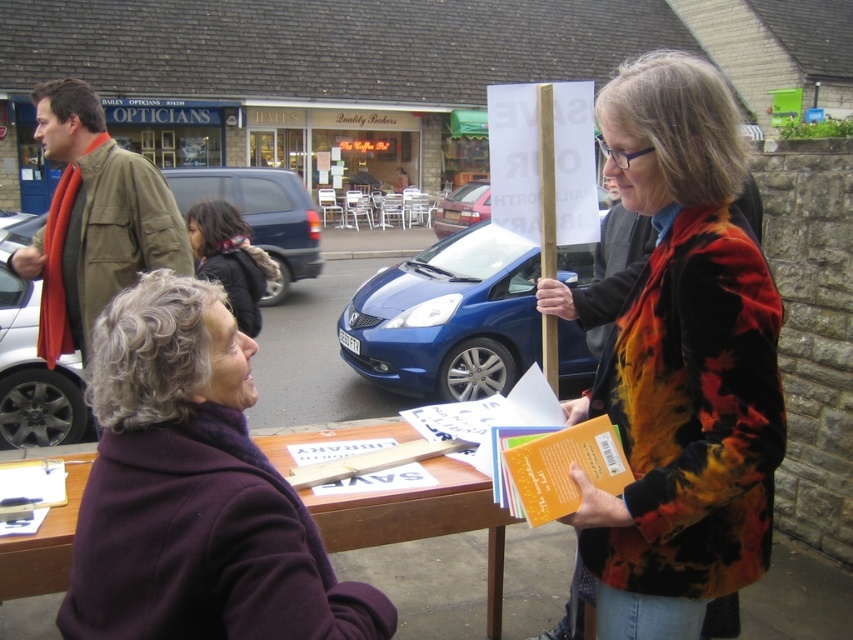
What is the color of the car located at the point with coordinates (33, 369)?

The metallic silver car at left is represented by point (33, 369).

You are a pedestrian trying to cross the street where the metallic silver car at left and the dark brown leather jacket at center are located. Which object is closer to the curb?

The metallic silver car at left is closer to the curb because it is positioned to the left of the dark brown leather jacket at center, and in typical street setups, vehicles are parked near the curb.